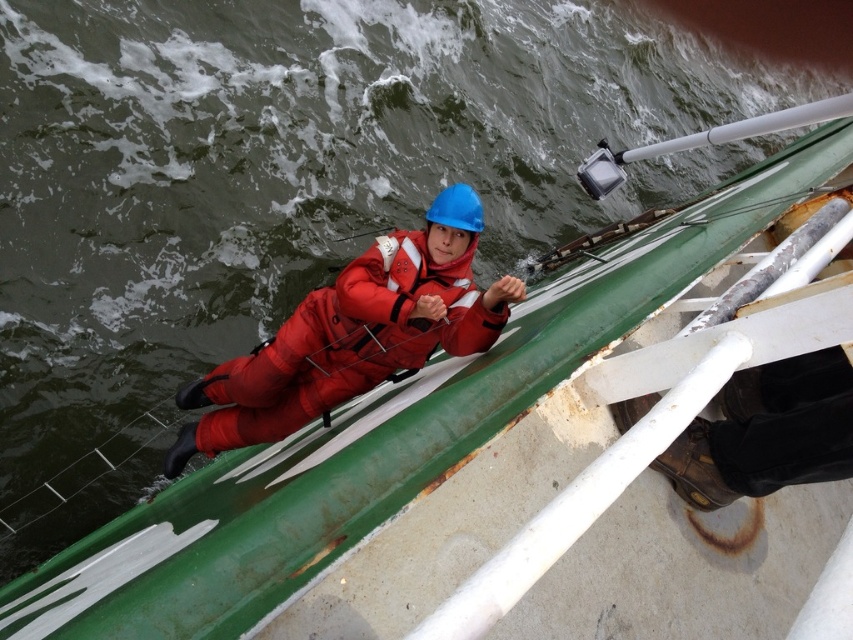
Is red matte suit at center to the right of red matte life jacket at center from the viewer's perspective?

In fact, red matte suit at center is to the left of red matte life jacket at center.

Is point (438, 323) closer to viewer compared to point (456, 321)?

Yes.

You are a GUI agent. You are given a task and a screenshot of the screen. Output one action in this format:
    pyautogui.click(x=<x>, y=<y>)
    Task: Click on the red matte suit at center
    The width and height of the screenshot is (853, 640).
    Given the screenshot: What is the action you would take?
    pyautogui.click(x=354, y=333)